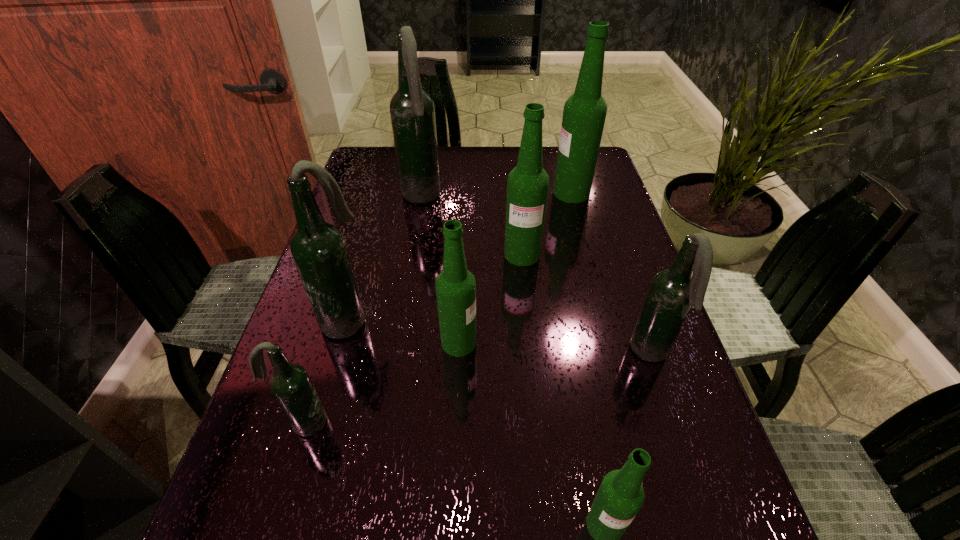
I want to click on free area in between the fourth beer bottle from left to right and the second biggest dark beer bottle, so tap(402, 331).

Locate an element on the screen. This screenshot has width=960, height=540. free spot between the second nearest beer bottle and the third smallest dark beer bottle is located at coordinates (325, 371).

This screenshot has height=540, width=960. Find the location of `free area in between the seventh farthest beer bottle and the third smallest dark beer bottle`. free area in between the seventh farthest beer bottle and the third smallest dark beer bottle is located at coordinates (325, 371).

Where is `free spot between the third farthest beer bottle and the rightmost dark beer bottle`? The width and height of the screenshot is (960, 540). free spot between the third farthest beer bottle and the rightmost dark beer bottle is located at coordinates (587, 304).

The image size is (960, 540). Find the location of `object that ranks as the third closest to the third smallest dark beer bottle`. object that ranks as the third closest to the third smallest dark beer bottle is located at coordinates (527, 186).

This screenshot has height=540, width=960. I want to click on object that stands as the closest to the third biggest green beer bottle, so tap(318, 248).

Point out which beer bottle is positioned as the second nearest to the second biggest dark beer bottle. Please provide its 2D coordinates. Your answer should be formatted as a tuple, i.e. [(x, y)], where the tuple contains the x and y coordinates of a point satisfying the conditions above.

[(455, 286)]

Choose which beer bottle is the fifth nearest neighbor to the third biggest green beer bottle. Please provide its 2D coordinates. Your answer should be formatted as a tuple, i.e. [(x, y)], where the tuple contains the x and y coordinates of a point satisfying the conditions above.

[(621, 495)]

Select which green beer bottle appears as the second closest to the fifth object from right to left. Please provide its 2D coordinates. Your answer should be formatted as a tuple, i.e. [(x, y)], where the tuple contains the x and y coordinates of a point satisfying the conditions above.

[(621, 495)]

Locate which green beer bottle is the closest to the third biggest dark beer bottle. Please provide its 2D coordinates. Your answer should be formatted as a tuple, i.e. [(x, y)], where the tuple contains the x and y coordinates of a point satisfying the conditions above.

[(621, 495)]